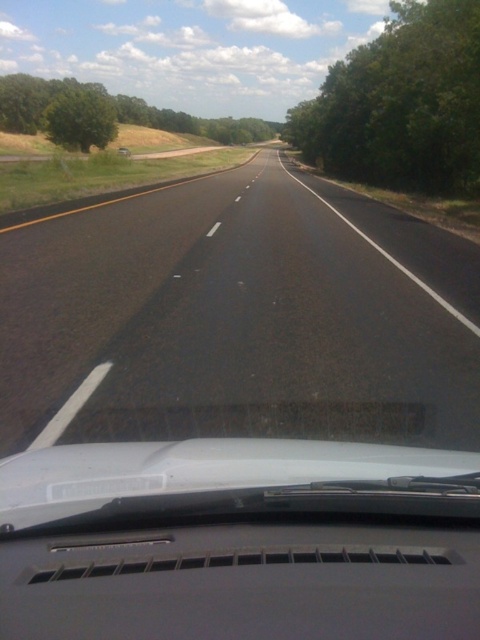
Question: Is black asphalt road at center positioned in front of green leafy tree at left?

Choices:
 (A) yes
 (B) no

Answer: (A)

Question: Which point is closer to the camera taking this photo?

Choices:
 (A) (386, 26)
 (B) (86, 276)
 (C) (379, 628)

Answer: (C)

Question: Does gray matte windshield at center appear on the right side of green leafy tree at upper center?

Choices:
 (A) yes
 (B) no

Answer: (A)

Question: Can you confirm if black asphalt road at center is bigger than green leafy tree at left?

Choices:
 (A) no
 (B) yes

Answer: (A)

Question: Which point is closer to the camera taking this photo?

Choices:
 (A) (29, 104)
 (B) (402, 225)
 (C) (51, 449)
 (D) (95, 125)

Answer: (C)

Question: Which point appears closest to the camera in this image?

Choices:
 (A) (74, 97)
 (B) (441, 516)
 (C) (416, 138)
 (D) (359, 316)

Answer: (B)